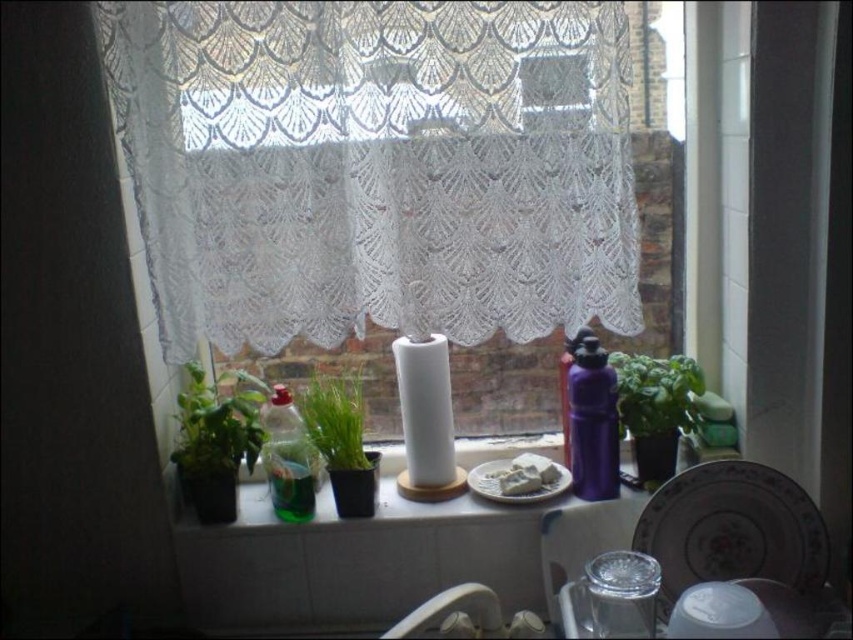
You are a chef preparing to place a tall glass on the white ceramic plate at lower right and the white glossy sink at lower center. Which surface can accommodate the glass without it exceeding the height limit?

The white ceramic plate at lower right has a greater height compared to the white glossy sink at lower center, so the glass can be placed on the white ceramic plate at lower right without exceeding the height limit.

You are organizing the kitchen and want to place a new bowl between the white ceramic plate at lower right and the white glossy sink at lower center. Is there enough space between them to fit the bowl?

The white ceramic plate at lower right is positioned on the right side of the white glossy sink at lower center. Since the plate is to the right of the sink, there is space between them where the bowl can be placed.

You are standing in front of the kitchen window with the lace curtain. You need to place a new potted plant exactly where the green leafy plant at left is currently located. What are the coordinates where you should place it?

The green leafy plant at left is located at coordinates point (x=218, y=420), so you should place the new potted plant at those coordinates.